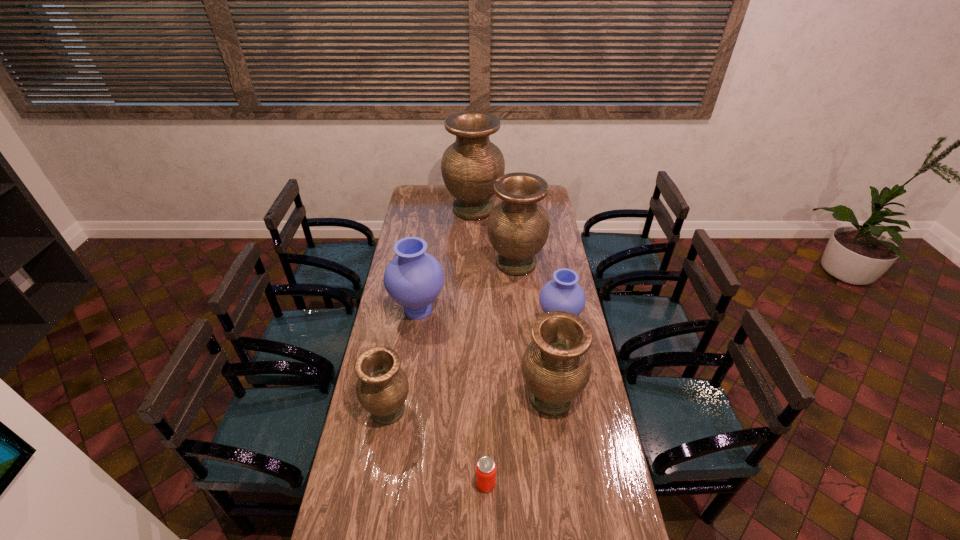
I want to click on blank space located on the left of the farthest vase, so click(414, 210).

Where is `free space located on the left of the second biggest green vase`? The image size is (960, 540). free space located on the left of the second biggest green vase is located at coordinates (460, 264).

Locate an element on the screen. Image resolution: width=960 pixels, height=540 pixels. blank space located 0.150m on the front of the left blue vase is located at coordinates (411, 359).

Image resolution: width=960 pixels, height=540 pixels. I want to click on free space located 0.220m on the left of the third biggest green vase, so click(x=461, y=397).

The image size is (960, 540). In order to click on vacant space positioned 0.200m on the front of the leftmost green vase in this screenshot , I will do `click(373, 490)`.

The width and height of the screenshot is (960, 540). I want to click on free region located on the left of the smaller blue vase, so click(x=452, y=322).

Find the location of a particular element. free space located 0.050m on the left of the shortest object is located at coordinates (461, 484).

The width and height of the screenshot is (960, 540). What are the coordinates of `object situated at the far edge` in the screenshot? It's located at (470, 166).

Find the location of a particular element. vacant area at the left edge is located at coordinates (408, 205).

In the image, there is a desktop. Where is `vacant space at the right edge`? The image size is (960, 540). vacant space at the right edge is located at coordinates (546, 242).